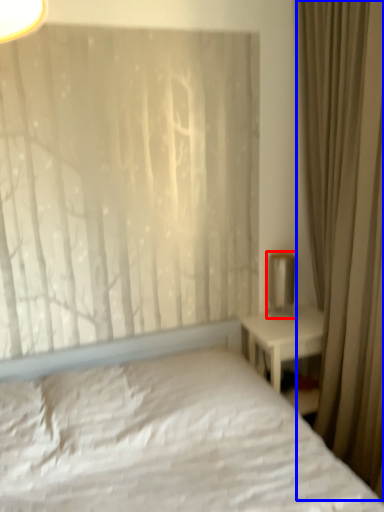
Question: Which object is closer to the camera taking this photo, table lamp (highlighted by a red box) or curtain (highlighted by a blue box)?

Choices:
 (A) table lamp
 (B) curtain

Answer: (B)